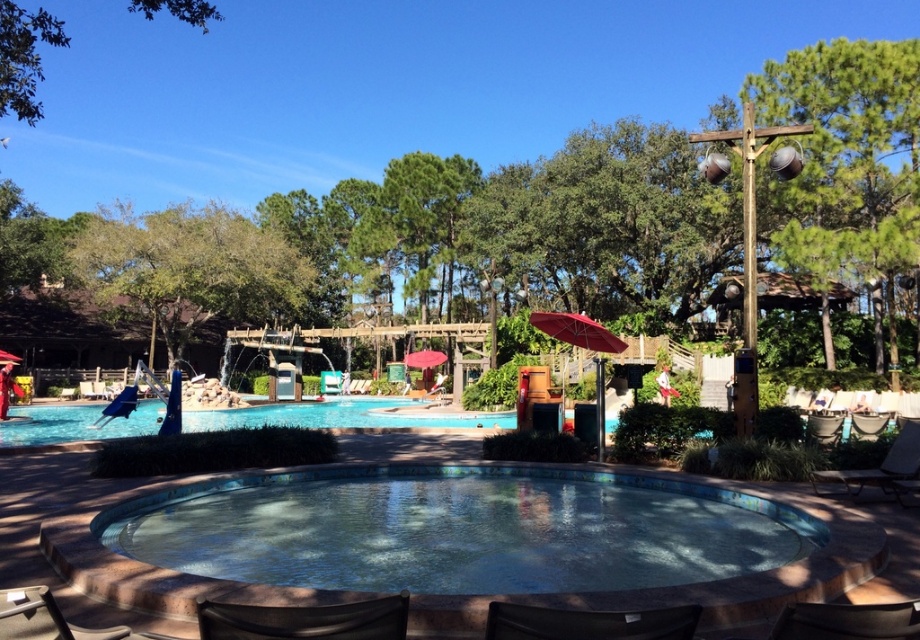
You are a guest at the resort and want to sit in the brown leather chair at lower left while still being able to see the matte red umbrella at center. Can you confirm if the chair is tall enough for you to have an unobstructed view of the umbrella?

The brown leather chair at lower left is not as tall as the matte red umbrella at center, so you would be able to see the umbrella without any obstruction.

You are a guest at the resort and want to sit in the shade. You see the brown leather chair at lower left and the matte red umbrella at center. Which object provides shade?

The matte red umbrella at center provides shade, as it is positioned above the brown leather chair at lower left.